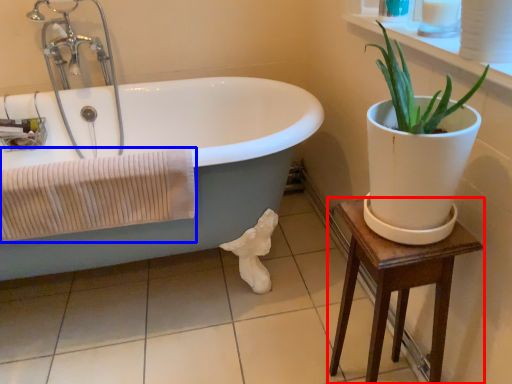
Question: Among these objects, which one is farthest to the camera, table (highlighted by a red box) or bath towel (highlighted by a blue box)?

Choices:
 (A) table
 (B) bath towel

Answer: (B)